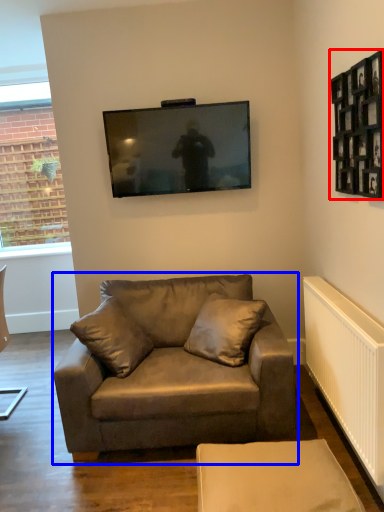
Question: Which point is further to the camera, picture frame (highlighted by a red box) or studio couch (highlighted by a blue box)?

Choices:
 (A) picture frame
 (B) studio couch

Answer: (B)